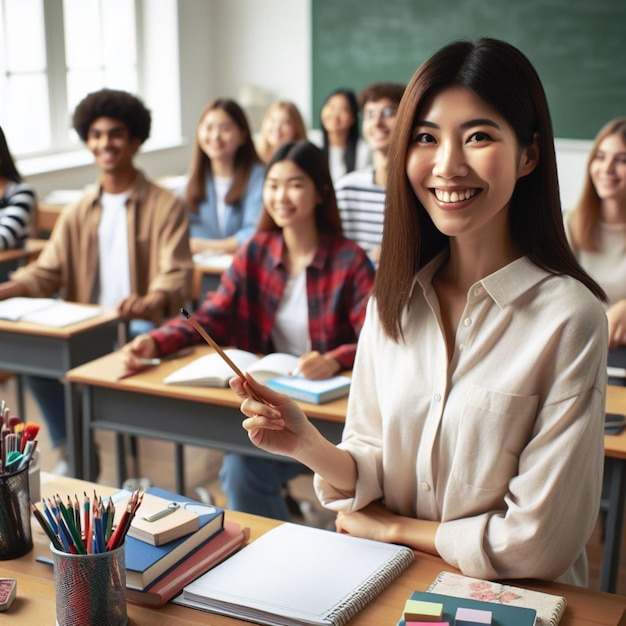
Point to any purple post its in the image. Your answer should be formatted as a list of tuples, i.e. [(x1, y1), (x2, y2), ...], where each tuple contains the x and y coordinates of a point satisfying the conditions above.

[(471, 622)]